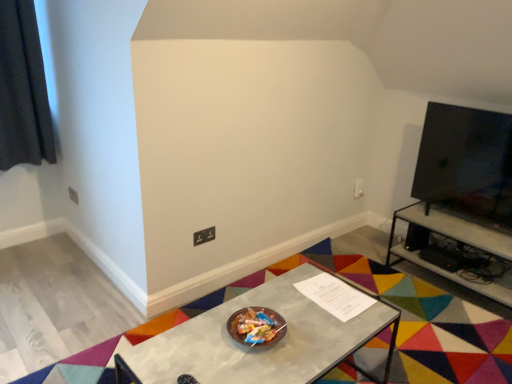
The height and width of the screenshot is (384, 512). Find the location of `matte black power outlet at lower center`. matte black power outlet at lower center is located at coordinates (204, 236).

You are a GUI agent. You are given a task and a screenshot of the screen. Output one action in this format:
    pyautogui.click(x=<x>, y=<y>)
    Task: Click on the black fabric curtain at upper left
    The image size is (512, 384).
    Given the screenshot: What is the action you would take?
    pyautogui.click(x=23, y=89)

Locate an element on the screen. matte black power outlet at lower center is located at coordinates (204, 236).

From the image's perspective, which table is the 2nd one below the black fabric curtain at upper left? Please provide its 2D coordinates.

[(261, 345)]

From the image's perspective, which is below, black fabric curtain at upper left or metallic gray table at center, which is the second table in right-to-left order?

metallic gray table at center, which is the second table in right-to-left order, is shown below in the image.

Is black fabric curtain at upper left positioned with its back to metallic gray table at center, arranged as the 2th table when viewed from the back?

That's not correct — black fabric curtain at upper left is not looking away from metallic gray table at center, arranged as the 2th table when viewed from the back.

Which object is more forward, black fabric curtain at upper left or metallic gray table at center, which is the second table in right-to-left order?

metallic gray table at center, which is the second table in right-to-left order, is in front.

How distant is metallic gray table at right, the second table when ordered from left to right, from matte black power outlet at lower center?

metallic gray table at right, the second table when ordered from left to right, is 1.33 meters away from matte black power outlet at lower center.

Considering the relative sizes of metallic gray table at right, the 1th table viewed from the right, and matte black power outlet at lower center in the image provided, is metallic gray table at right, the 1th table viewed from the right, bigger than matte black power outlet at lower center?

Indeed, metallic gray table at right, the 1th table viewed from the right, has a larger size compared to matte black power outlet at lower center.

Is metallic gray table at right, placed as the 2th table when sorted from front to back, not close to matte black power outlet at lower center?

Yes, metallic gray table at right, placed as the 2th table when sorted from front to back, and matte black power outlet at lower center are located far from each other.

Is metallic gray table at right, the 1th table viewed from the right, closer to the viewer compared to matte black power outlet at lower center?

Yes, the depth of metallic gray table at right, the 1th table viewed from the right, is less than that of matte black power outlet at lower center.

Which object is wider, black fabric curtain at upper left or matte black power outlet at lower center?

Wider between the two is black fabric curtain at upper left.

From the image's perspective, which one is positioned higher, black fabric curtain at upper left or matte black power outlet at lower center?

black fabric curtain at upper left is shown above in the image.

Is black fabric curtain at upper left next to matte black power outlet at lower center?

No, black fabric curtain at upper left is not in contact with matte black power outlet at lower center.

Is black fabric curtain at upper left bigger or smaller than matte black power outlet at lower center?

In the image, black fabric curtain at upper left appears to be larger than matte black power outlet at lower center.

From a real-world perspective, is matte black power outlet at lower center beneath metallic gray table at center, placed as the first table when sorted from left to right?

Actually, matte black power outlet at lower center is physically above metallic gray table at center, placed as the first table when sorted from left to right, in the real world.

Considering the relative positions of matte black power outlet at lower center and metallic gray table at center, marked as the 1th table in a front-to-back arrangement, in the image provided, is matte black power outlet at lower center to the right of metallic gray table at center, marked as the 1th table in a front-to-back arrangement, from the viewer's perspective?

No.

Does matte black power outlet at lower center have a greater width compared to metallic gray table at center, placed as the first table when sorted from left to right?

No.

Starting from the matte black power outlet at lower center, which table is the 2nd one in front? Please provide its 2D coordinates.

[(261, 345)]

Considering the relative positions of metallic gray table at center, which is the second table in right-to-left order, and metallic gray table at right, arranged as the 1th table when viewed from the back, in the image provided, is metallic gray table at center, which is the second table in right-to-left order, behind metallic gray table at right, arranged as the 1th table when viewed from the back,?

That is False.

Is metallic gray table at center, arranged as the 2th table when viewed from the back, not near metallic gray table at right, the second table when ordered from left to right?

That's right, there is a large distance between metallic gray table at center, arranged as the 2th table when viewed from the back, and metallic gray table at right, the second table when ordered from left to right.

Is metallic gray table at center, which is the second table in right-to-left order, inside the boundaries of metallic gray table at right, placed as the 2th table when sorted from front to back, or outside?

metallic gray table at center, which is the second table in right-to-left order, is outside metallic gray table at right, placed as the 2th table when sorted from front to back.

Considering the positions of points (284, 336) and (470, 224), is point (284, 336) farther from camera compared to point (470, 224)?

No, (284, 336) is in front of (470, 224).

You are a GUI agent. You are given a task and a screenshot of the screen. Output one action in this format:
    pyautogui.click(x=<x>, y=<y>)
    Task: Click on the table that is the 1st object directly below the black fabric curtain at upper left (from a real-world perspective)
    This screenshot has width=512, height=384.
    Given the screenshot: What is the action you would take?
    pyautogui.click(x=261, y=345)

From the image's perspective, who appears lower, metallic gray table at center, placed as the first table when sorted from left to right, or black fabric curtain at upper left?

metallic gray table at center, placed as the first table when sorted from left to right, appears lower in the image.

Consider the image. Is the position of matte black power outlet at lower center more distant than that of metallic gray table at right, the second table when ordered from left to right?

Yes.

Considering the points (206, 234) and (422, 262), which point is behind, point (206, 234) or point (422, 262)?

Positioned behind is point (422, 262).

From the image's perspective, which is below, matte black power outlet at lower center or metallic gray table at right, arranged as the 1th table when viewed from the back?

metallic gray table at right, arranged as the 1th table when viewed from the back, is shown below in the image.

Which of these two, matte black power outlet at lower center or metallic gray table at right, placed as the 2th table when sorted from front to back, is wider?

metallic gray table at right, placed as the 2th table when sorted from front to back.

Find the location of a particular element. Image resolution: width=512 pixels, height=384 pixels. curtain above the metallic gray table at center, arranged as the 2th table when viewed from the back (from a real-world perspective) is located at coordinates (23, 89).

From the matte black power outlet at lower center, count 2nd table to the right and point to it. Please provide its 2D coordinates.

[(457, 277)]

When comparing their distances from matte black power outlet at lower center, does black fabric curtain at upper left or metallic gray table at center, placed as the first table when sorted from left to right, seem further?

black fabric curtain at upper left lies further to matte black power outlet at lower center than the other object.

When comparing their distances from metallic gray table at right, the 1th table viewed from the right, does matte black power outlet at lower center or black fabric curtain at upper left seem closer?

The object closer to metallic gray table at right, the 1th table viewed from the right, is matte black power outlet at lower center.

Looking at this image, from the image, which object appears to be farther from black fabric curtain at upper left, matte black power outlet at lower center or metallic gray table at right, placed as the 2th table when sorted from front to back?

Based on the image, metallic gray table at right, placed as the 2th table when sorted from front to back, appears to be further to black fabric curtain at upper left.

From the image, which object appears to be farther from matte black power outlet at lower center, metallic gray table at right, arranged as the 1th table when viewed from the back, or metallic gray table at center, placed as the first table when sorted from left to right?

Based on the image, metallic gray table at right, arranged as the 1th table when viewed from the back, appears to be further to matte black power outlet at lower center.

Based on their spatial positions, is metallic gray table at right, arranged as the 1th table when viewed from the back, or matte black power outlet at lower center further from black fabric curtain at upper left?

Among the two, metallic gray table at right, arranged as the 1th table when viewed from the back, is located further to black fabric curtain at upper left.

Which object lies further to the anchor point metallic gray table at center, which is the second table in right-to-left order, black fabric curtain at upper left or metallic gray table at right, the second table when ordered from left to right?

Among the two, black fabric curtain at upper left is located further to metallic gray table at center, which is the second table in right-to-left order.

Considering their positions, is matte black power outlet at lower center positioned further to metallic gray table at center, which is the second table in right-to-left order, than black fabric curtain at upper left?

black fabric curtain at upper left.

From the image, which object appears to be nearer to matte black power outlet at lower center, black fabric curtain at upper left or metallic gray table at right, the 1th table viewed from the right?

Among the two, metallic gray table at right, the 1th table viewed from the right, is located nearer to matte black power outlet at lower center.

Where is `square situated between black fabric curtain at upper left and metallic gray table at center, placed as the first table when sorted from left to right, from left to right`? Image resolution: width=512 pixels, height=384 pixels. square situated between black fabric curtain at upper left and metallic gray table at center, placed as the first table when sorted from left to right, from left to right is located at coordinates (204, 236).

The image size is (512, 384). I want to click on square situated between black fabric curtain at upper left and metallic gray table at right, placed as the 2th table when sorted from front to back, from left to right, so click(x=204, y=236).

Identify the location of table situated between black fabric curtain at upper left and metallic gray table at right, arranged as the 1th table when viewed from the back, from left to right. The image size is (512, 384). (261, 345).

Image resolution: width=512 pixels, height=384 pixels. What are the coordinates of `table located between matte black power outlet at lower center and metallic gray table at right, placed as the 2th table when sorted from front to back, in the left-right direction` in the screenshot? It's located at [x=261, y=345].